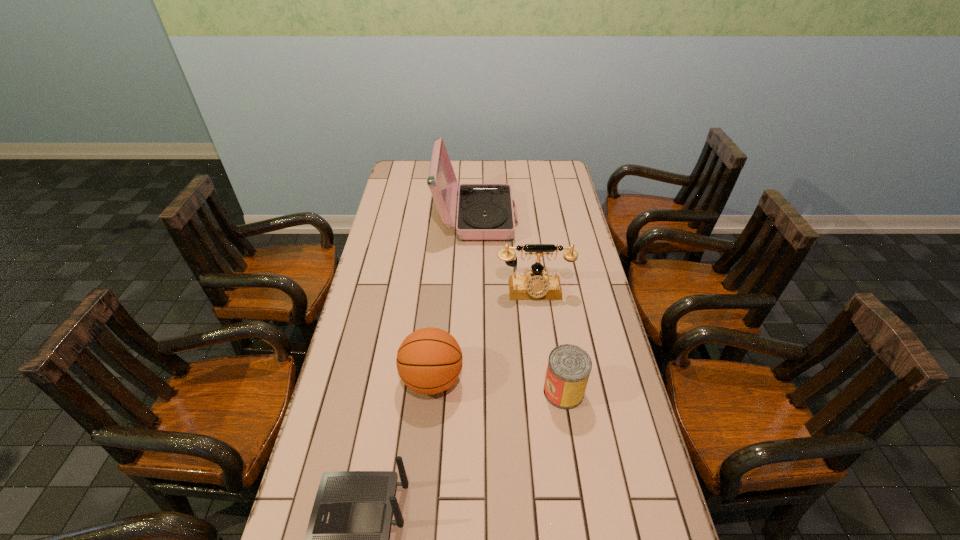
The height and width of the screenshot is (540, 960). What are the coordinates of `record player` in the screenshot? It's located at (484, 211).

Locate an element on the screen. This screenshot has width=960, height=540. the tallest object is located at coordinates (484, 211).

The width and height of the screenshot is (960, 540). I want to click on the fourth nearest object, so pos(534,286).

Image resolution: width=960 pixels, height=540 pixels. In order to click on basketball in this screenshot , I will do `click(429, 360)`.

Identify the location of can. (569, 366).

Locate an element on the screen. free spot located 0.200m with the lid open on the farthest object is located at coordinates (564, 218).

Locate an element on the screen. The image size is (960, 540). free space located on the dial of the second farthest object is located at coordinates (539, 334).

Locate an element on the screen. vacant space located 0.320m on the right of the basketball is located at coordinates (573, 380).

Find the location of `free space located 0.280m on the left of the can`. free space located 0.280m on the left of the can is located at coordinates (445, 392).

Where is `telephone that is at the right edge`? telephone that is at the right edge is located at coordinates (534, 286).